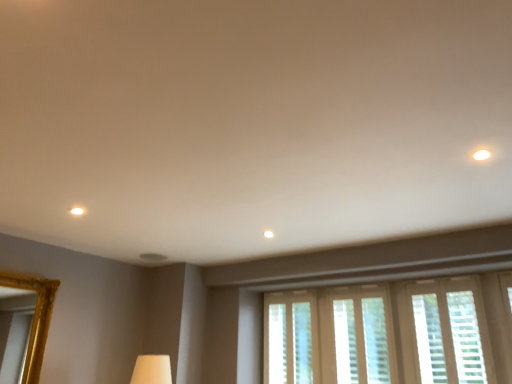
Question: Is the position of translucent plastic blinds at center, which appears as the third window when viewed from the right, less distant than that of translucent plastic blinds at lower center, which appears as the 2th window when viewed from the left?

Choices:
 (A) yes
 (B) no

Answer: (B)

Question: Can you confirm if translucent plastic blinds at center, which appears as the third window when viewed from the right, is bigger than translucent plastic blinds at lower center, which appears as the 2th window when viewed from the left?

Choices:
 (A) no
 (B) yes

Answer: (B)

Question: Is translucent plastic blinds at lower center, which appears as the 2th window when viewed from the left, inside translucent plastic blinds at center, which appears as the third window when viewed from the right?

Choices:
 (A) no
 (B) yes

Answer: (A)

Question: From the image's perspective, is translucent plastic blinds at center, which appears as the third window when viewed from the right, under translucent plastic blinds at lower center, the second window viewed from the right?

Choices:
 (A) yes
 (B) no

Answer: (A)

Question: Is translucent plastic blinds at center, marked as the 1th window in a left-to-right arrangement, positioned with its back to translucent plastic blinds at lower center, the second window viewed from the right?

Choices:
 (A) yes
 (B) no

Answer: (B)

Question: Choose the correct answer: Is white textured blinds at lower right, the 3th window positioned from the left, inside translucent plastic blinds at center, marked as the 1th window in a left-to-right arrangement, or outside it?

Choices:
 (A) outside
 (B) inside

Answer: (A)

Question: Considering the positions of point (426, 326) and point (268, 301), is point (426, 326) closer or farther from the camera than point (268, 301)?

Choices:
 (A) closer
 (B) farther

Answer: (A)

Question: Looking at the image, does white textured blinds at lower right, the first window positioned from the right, seem bigger or smaller compared to translucent plastic blinds at center, marked as the 1th window in a left-to-right arrangement?

Choices:
 (A) big
 (B) small

Answer: (B)

Question: Is white textured blinds at lower right, the first window positioned from the right, taller or shorter than translucent plastic blinds at center, which appears as the third window when viewed from the right?

Choices:
 (A) short
 (B) tall

Answer: (A)

Question: Does point (384, 311) appear closer or farther from the camera than point (465, 347)?

Choices:
 (A) closer
 (B) farther

Answer: (B)

Question: Based on their sizes in the image, would you say translucent plastic blinds at lower center, the second window viewed from the right, is bigger or smaller than white textured blinds at lower right, the first window positioned from the right?

Choices:
 (A) small
 (B) big

Answer: (B)

Question: Considering their positions, is translucent plastic blinds at lower center, the second window viewed from the right, located in front of or behind white textured blinds at lower right, the 3th window positioned from the left?

Choices:
 (A) behind
 (B) front

Answer: (A)

Question: Which is correct: translucent plastic blinds at lower center, which appears as the 2th window when viewed from the left, is inside white textured blinds at lower right, the first window positioned from the right, or outside of it?

Choices:
 (A) inside
 (B) outside

Answer: (B)

Question: In terms of size, does translucent plastic blinds at center, which appears as the third window when viewed from the right, appear bigger or smaller than translucent plastic blinds at lower center, which appears as the 2th window when viewed from the left?

Choices:
 (A) big
 (B) small

Answer: (A)

Question: In terms of width, does translucent plastic blinds at center, which appears as the third window when viewed from the right, look wider or thinner when compared to translucent plastic blinds at lower center, which appears as the 2th window when viewed from the left?

Choices:
 (A) thin
 (B) wide

Answer: (B)